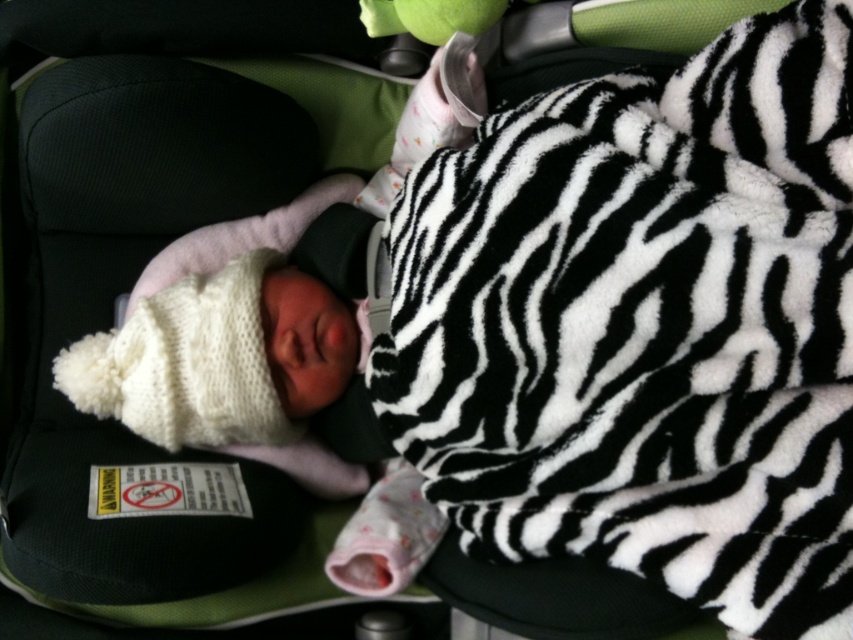
From the picture: Between zebra-patterned fleece blanket at center and white knitted hat at center, which one has less height?

Standing shorter between the two is white knitted hat at center.

Between zebra-patterned fleece blanket at center and white knitted hat at center, which one is positioned higher?

zebra-patterned fleece blanket at center

Does point (686, 86) come behind point (271, 454)?

No, (686, 86) is in front of (271, 454).

I want to click on zebra-patterned fleece blanket at center, so click(646, 324).